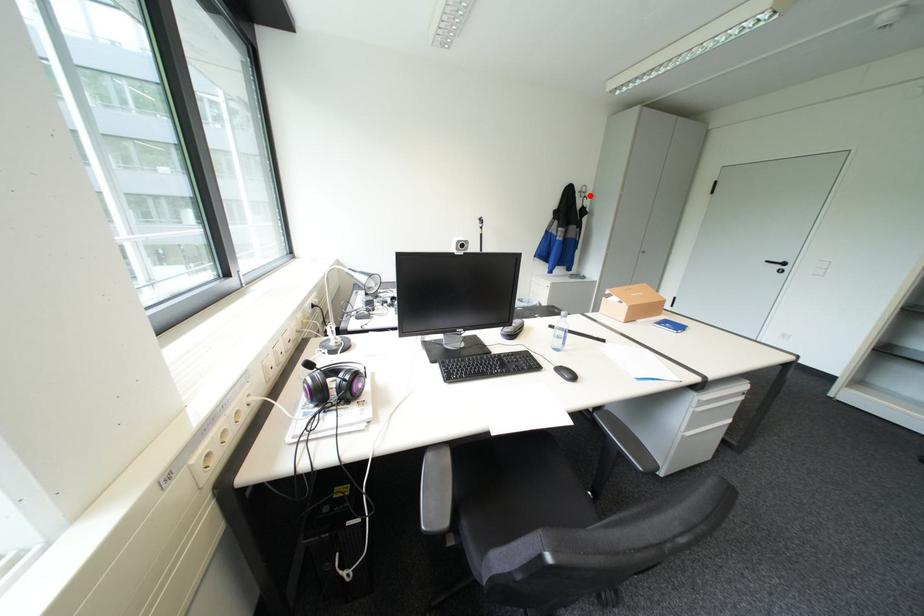
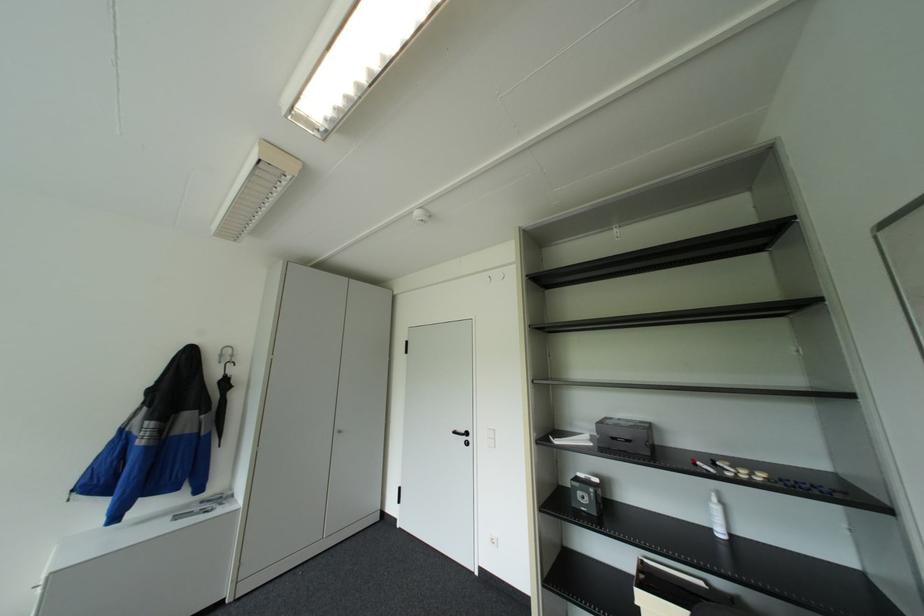
Question: I am providing you with two images of the same scene from different viewpoints. A red point is shown in image1. For the corresponding object point in image2, is it positioned nearer or farther from the camera?

Choices:
 (A) Nearer
 (B) Farther

Answer: (B)